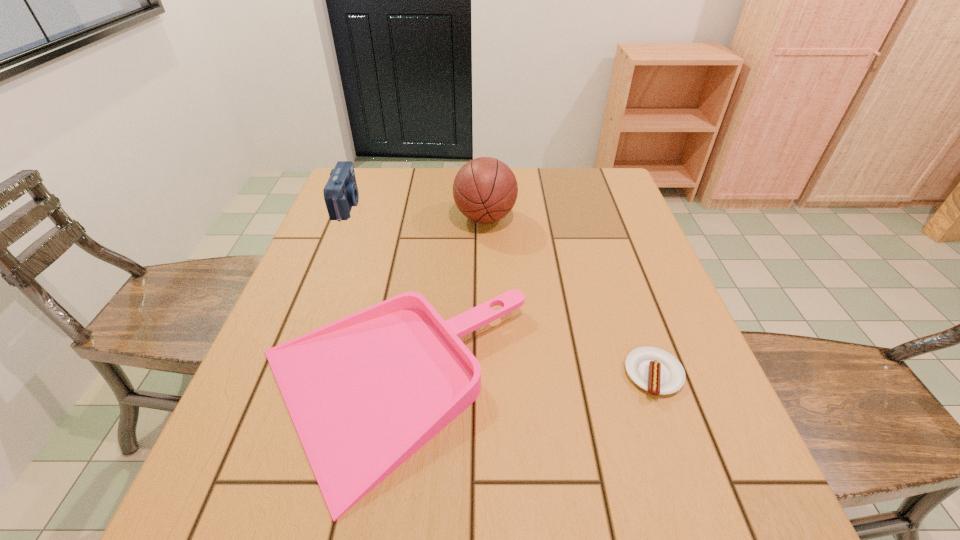
Locate an element on the screen. The width and height of the screenshot is (960, 540). object located in the near edge section of the desktop is located at coordinates (365, 392).

This screenshot has width=960, height=540. Find the location of `camera situated at the left edge`. camera situated at the left edge is located at coordinates (341, 192).

At what (x,y) coordinates should I click in order to perform the action: click on dustpan located at the left edge. Please return your answer as a coordinate pair (x, y). Looking at the image, I should click on tap(365, 392).

Where is `object that is at the right edge`? object that is at the right edge is located at coordinates (655, 370).

At what (x,y) coordinates should I click in order to perform the action: click on object positioned at the far left corner. Please return your answer as a coordinate pair (x, y). Looking at the image, I should click on coord(341,192).

What are the coordinates of `object located in the near left corner section of the desktop` in the screenshot? It's located at (365, 392).

Find the location of a particular element. free region at the far edge of the desktop is located at coordinates (531, 196).

This screenshot has height=540, width=960. I want to click on free space at the left edge of the desktop, so click(326, 210).

At what (x,y) coordinates should I click in order to perform the action: click on vacant space at the right edge of the desktop. Please return your answer as a coordinate pair (x, y). This screenshot has width=960, height=540. Looking at the image, I should click on (599, 229).

In the image, there is a desktop. Identify the location of vacant space at the near left corner. (280, 523).